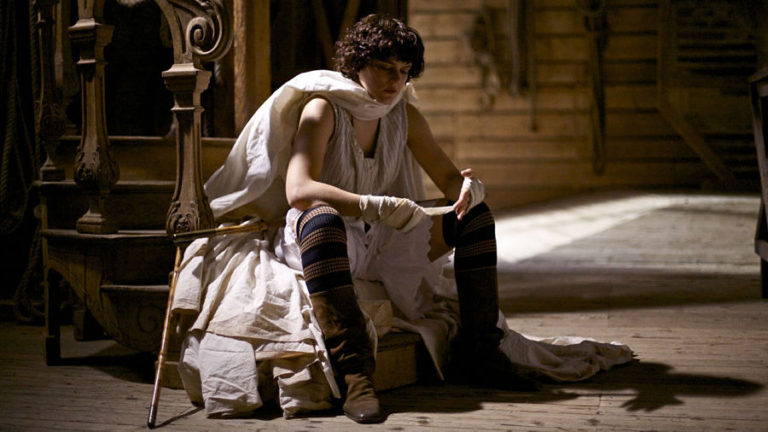
Find the location of a particular element. This screenshot has height=432, width=768. floor is located at coordinates (693, 333).